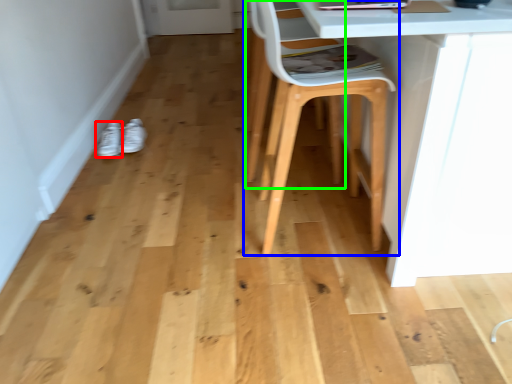
Question: Estimate the real-world distances between objects in this image. Which object is closer to footwear (highlighted by a red box), chair (highlighted by a blue box) or swivel chair (highlighted by a green box)?

Choices:
 (A) chair
 (B) swivel chair

Answer: (B)